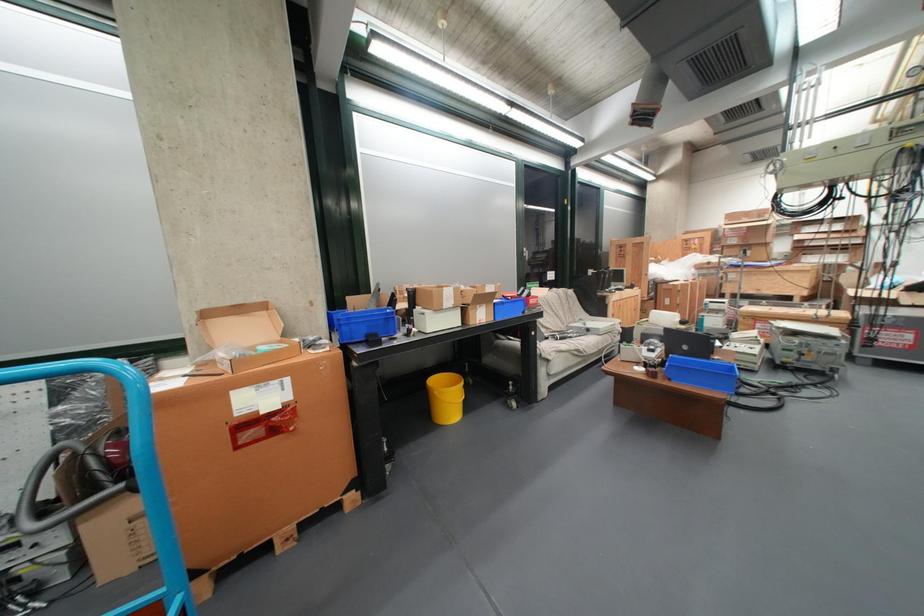
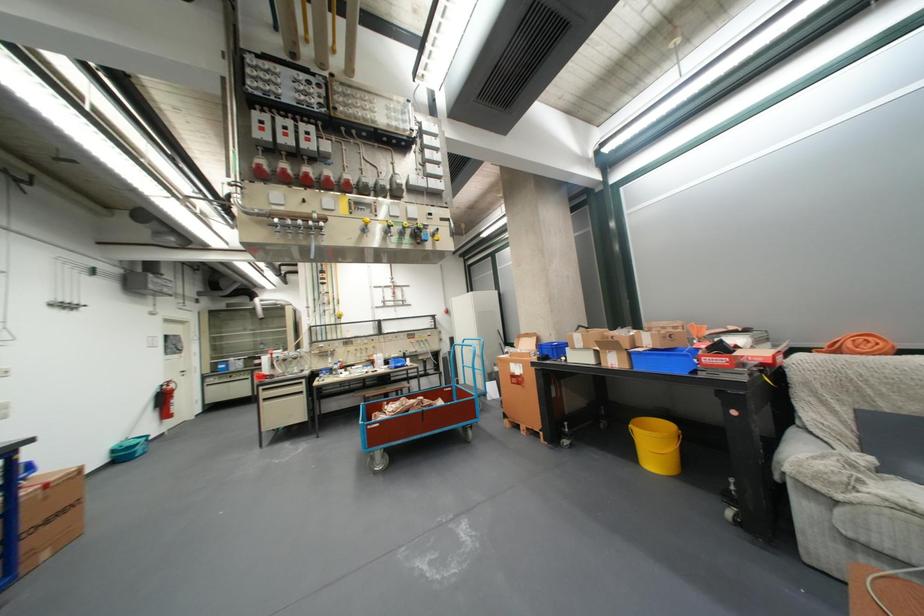
In the second image, find the point that corresponds to point (504, 320) in the first image.

(638, 368)